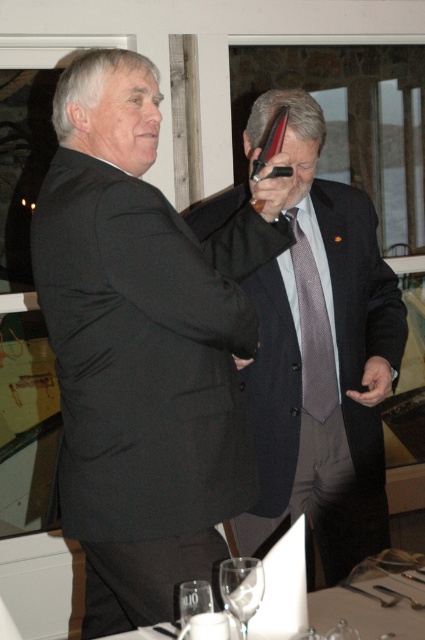
Does black matte suit at left have a greater height compared to clear glass wine glass at lower center?

Correct, black matte suit at left is much taller as clear glass wine glass at lower center.

Does black matte suit at left have a smaller size compared to clear glass wine glass at lower center?

Incorrect, black matte suit at left is not smaller in size than clear glass wine glass at lower center.

Which is behind, point (235, 404) or point (235, 592)?

Point (235, 404)

Where is `black matte suit at left`? This screenshot has height=640, width=425. black matte suit at left is located at coordinates (141, 348).

Can you confirm if gray textured tie at center is bigger than clear glass wine glass at lower center?

Yes.

Is point (319, 353) in front of point (248, 570)?

No, (319, 353) is further to viewer.

The height and width of the screenshot is (640, 425). What are the coordinates of `gray textured tie at center` in the screenshot? It's located at (312, 330).

This screenshot has height=640, width=425. I want to click on gray textured tie at center, so click(312, 330).

How far apart are clear glassware at center and transparent glass at lower center?

clear glassware at center is 1.94 meters from transparent glass at lower center.

Does clear glassware at center have a lesser height compared to transparent glass at lower center?

No, clear glassware at center is not shorter than transparent glass at lower center.

Between point (79, 576) and point (333, 632), which one is positioned in front?

Positioned in front is point (333, 632).

The image size is (425, 640). I want to click on clear glassware at center, so click(x=42, y=588).